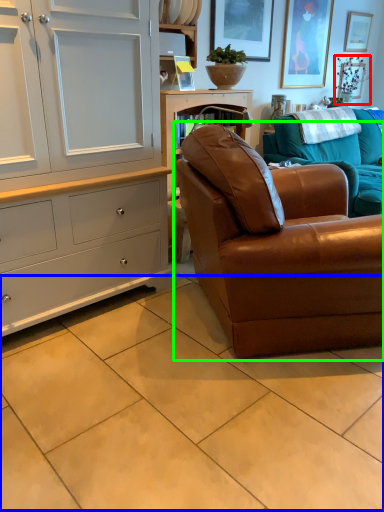
Question: Which is farther away from plant (highlighted by a red box)? ceramic tile (highlighted by a blue box) or studio couch (highlighted by a green box)?

Choices:
 (A) ceramic tile
 (B) studio couch

Answer: (A)